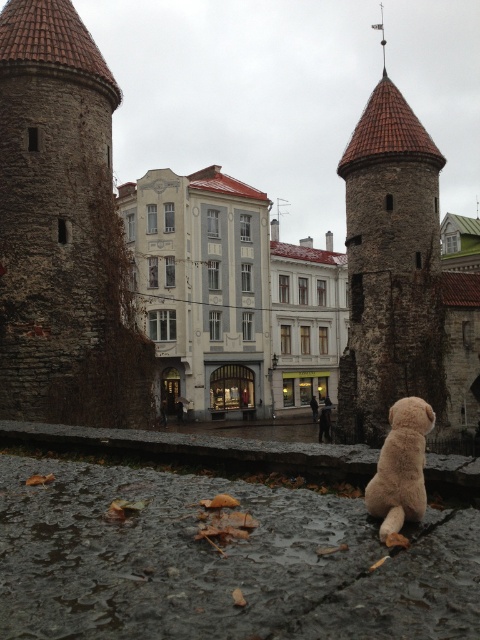
Is rusty metal tower at center below fuzzy beige stuffed animal at lower right?

No.

This screenshot has width=480, height=640. Identify the location of rusty metal tower at center. (391, 266).